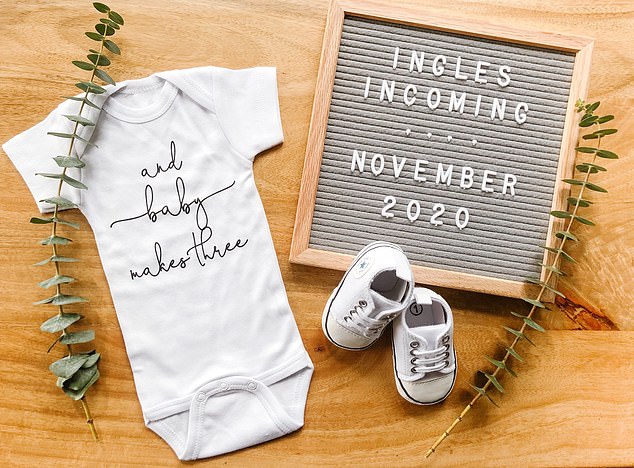
The width and height of the screenshot is (634, 468). What are the coordinates of `stickers` in the screenshot? It's located at (432, 449), (446, 432), (458, 419), (91, 418).